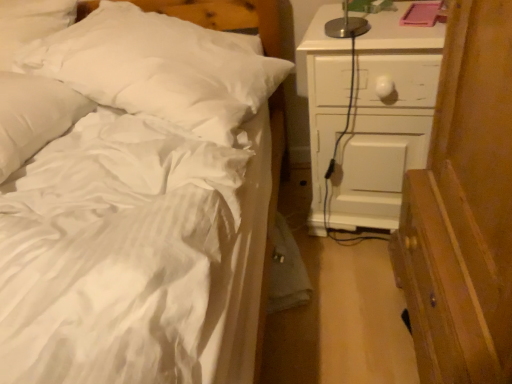
Identify the location of free space above white painted wood chest of drawers at right (from a real-world perspective). (365, 16).